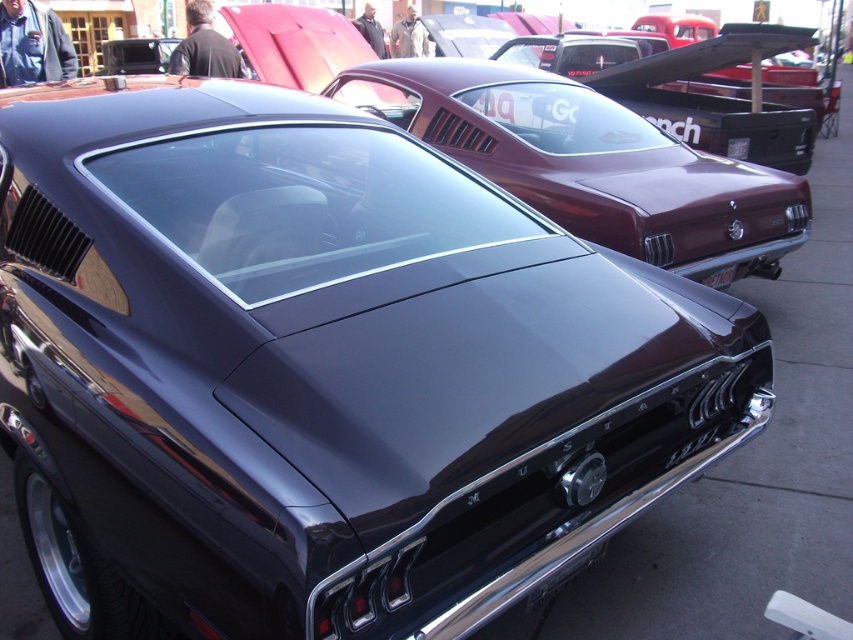
Is black plastic license plate at center smaller than black plastic license plate at rear?

Correct, black plastic license plate at center occupies less space than black plastic license plate at rear.

Is point (730, 264) farther from camera compared to point (746, 150)?

That is False.

Locate an element on the screen. black plastic license plate at center is located at coordinates 718,276.

Measure the distance between glossy black car at center and camera.

5.11 meters

Is glossy black car at center thinner than black plastic license plate at center?

No.

The height and width of the screenshot is (640, 853). I want to click on glossy black car at center, so click(549, 147).

Is point (509, 129) closer to camera compared to point (734, 147)?

Yes.

Can you confirm if glossy black car at center is taller than black plastic license plate at rear?

Indeed, glossy black car at center has a greater height compared to black plastic license plate at rear.

Is point (283, 76) positioned before point (738, 138)?

No.

Where is `glossy black car at center`? The width and height of the screenshot is (853, 640). glossy black car at center is located at coordinates (549, 147).